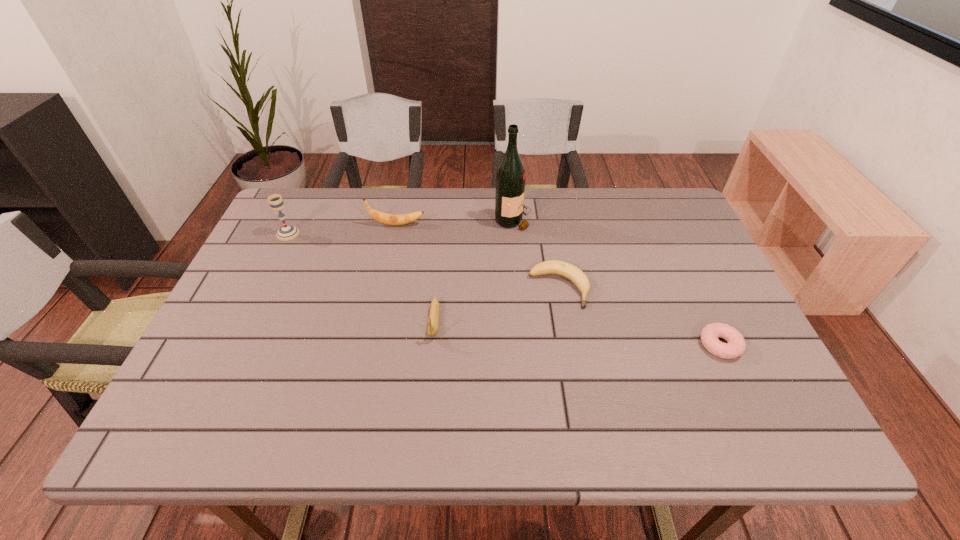
In order to click on object located in the right edge section of the desktop in this screenshot , I will do `click(735, 347)`.

The height and width of the screenshot is (540, 960). What are the coordinates of `object at the far left corner` in the screenshot? It's located at (287, 232).

Image resolution: width=960 pixels, height=540 pixels. Find the location of `vacant space at the far edge of the desktop`. vacant space at the far edge of the desktop is located at coordinates (539, 200).

The width and height of the screenshot is (960, 540). In the image, there is a desktop. Identify the location of free space at the near edge. (634, 418).

Locate an element on the screen. This screenshot has width=960, height=540. vacant space at the left edge of the desktop is located at coordinates (319, 239).

In the image, there is a desktop. Where is `vacant space at the right edge`? Image resolution: width=960 pixels, height=540 pixels. vacant space at the right edge is located at coordinates tap(708, 273).

Locate an element on the screen. Image resolution: width=960 pixels, height=540 pixels. vacant area at the far left corner of the desktop is located at coordinates (318, 210).

Where is `free space that is in between the second banana from right to left and the shortest banana`? The height and width of the screenshot is (540, 960). free space that is in between the second banana from right to left and the shortest banana is located at coordinates (496, 305).

Where is `vacant area that lies between the fifth shortest object and the third tallest object`? The width and height of the screenshot is (960, 540). vacant area that lies between the fifth shortest object and the third tallest object is located at coordinates (343, 229).

Identify the location of free space between the shortest banana and the chalice. This screenshot has width=960, height=540. (423, 261).